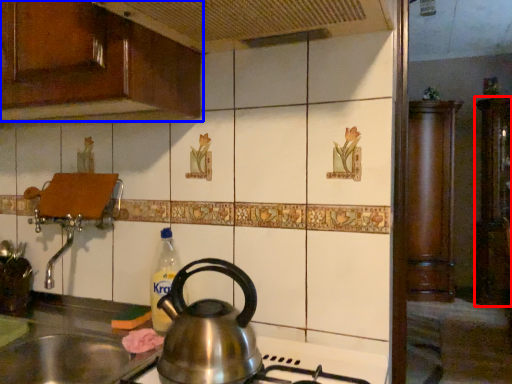
Question: Which object appears closest to the camera in this image, cabinetry (highlighted by a red box) or cabinetry (highlighted by a blue box)?

Choices:
 (A) cabinetry
 (B) cabinetry

Answer: (B)